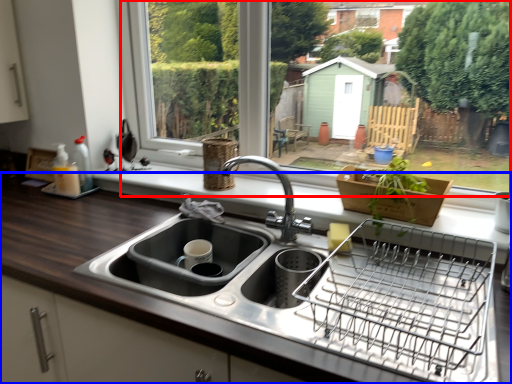
Question: Among these objects, which one is nearest to the camera, window frame (highlighted by a red box) or countertop (highlighted by a blue box)?

Choices:
 (A) window frame
 (B) countertop

Answer: (B)